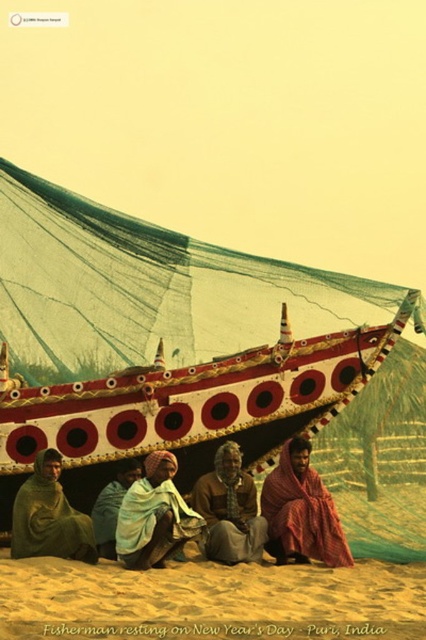
You are a tourist visiting Puri beach on New Year morning. You want to place a small bag on the sandy yellow sand at lower center and the red woven cloth at lower right. Which surface can you place your bag on without it getting wet?

You can place your bag on the sandy yellow sand at lower center because it is wider than the red woven cloth at lower right, so there is enough space to place the bag without it getting wet.

You are standing on the beach at Puri, India, and you see two points marked on the sand. The first point is at coordinate point (91, 552), and the second is at point (255, 493). Which point is closer to your current position?

The point at (91, 552) is closer to your current position because it is closer to the camera than point (255, 493).